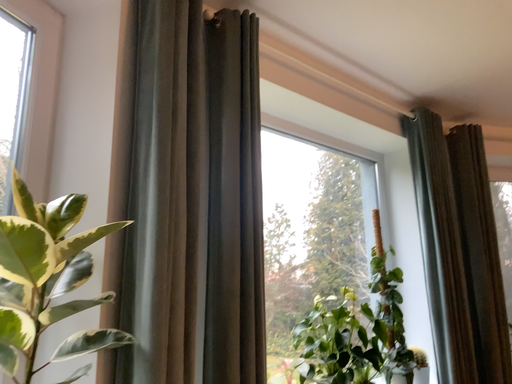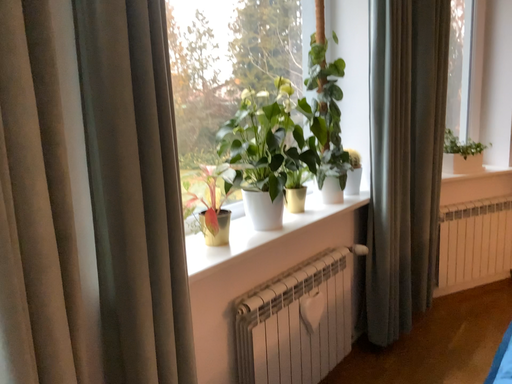
Question: Which way did the camera rotate in the video?

Choices:
 (A) rotated upward
 (B) rotated downward

Answer: (B)